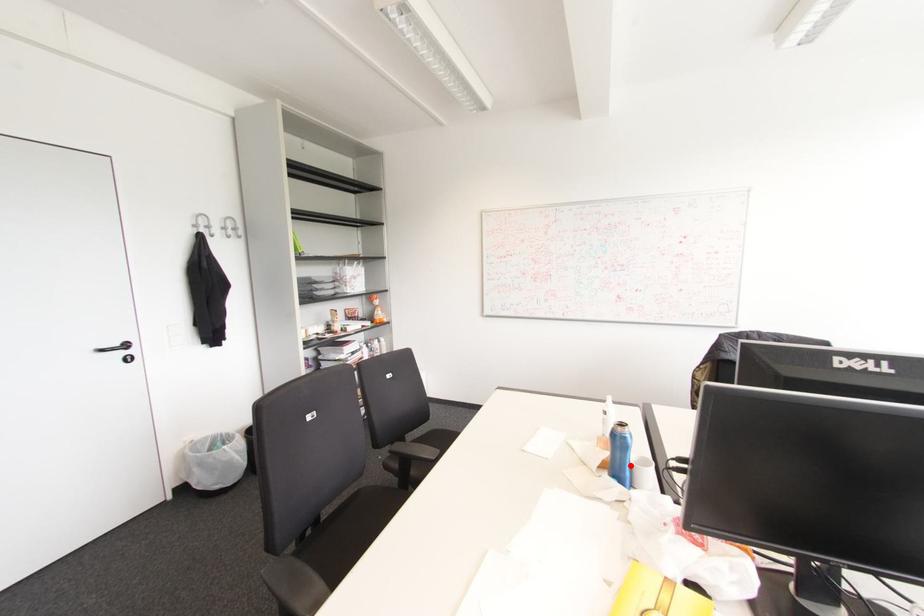
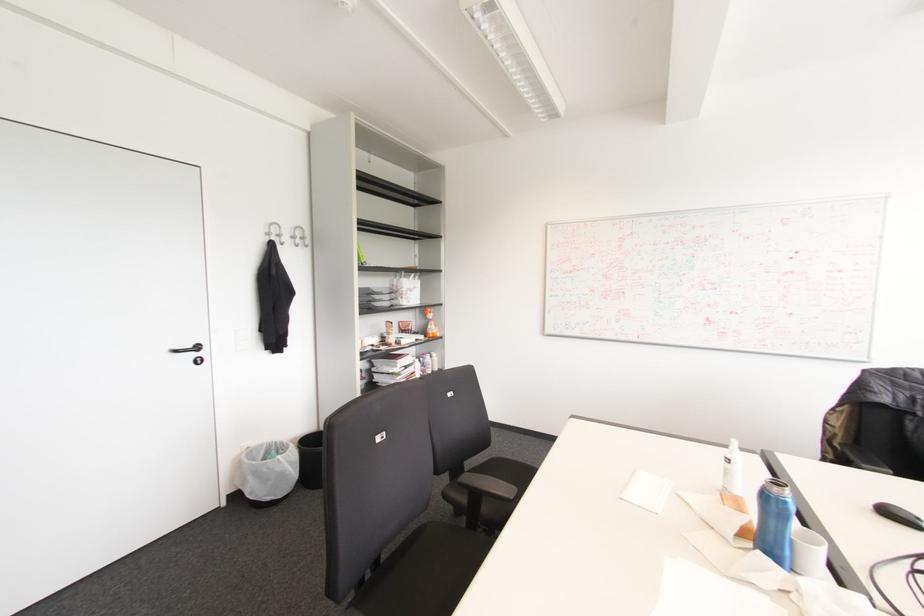
Question: A red point is marked in image1. In image2, is the corresponding 3D point closer to the camera or farther? Reply with the corresponding letter.

Choices:
 (A) The corresponding 3D point is closer.
 (B) The corresponding 3D point is farther.

Answer: (A)